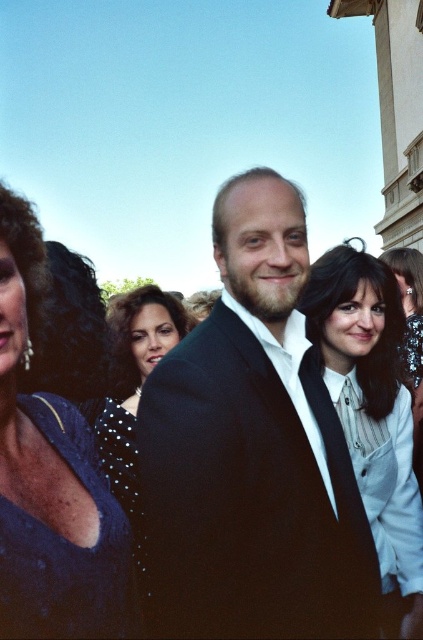
Question: Does black matte suit at center appear on the right side of black dotted dress at center?

Choices:
 (A) yes
 (B) no

Answer: (A)

Question: Does matte blue dress at left appear on the right side of white textured shirt at center?

Choices:
 (A) no
 (B) yes

Answer: (A)

Question: Which of the following is the farthest from the observer?

Choices:
 (A) (3, 496)
 (B) (247, 620)
 (C) (417, 531)

Answer: (C)

Question: Estimate the real-world distances between objects in this image. Which object is farther from the black dotted dress at center?

Choices:
 (A) matte blue dress at left
 (B) white textured shirt at center
 (C) black matte suit at center

Answer: (B)

Question: Which point appears closest to the camera in this image?

Choices:
 (A) (x=400, y=298)
 (B) (x=142, y=532)

Answer: (B)

Question: Is matte blue dress at left below black dotted dress at center?

Choices:
 (A) yes
 (B) no

Answer: (B)